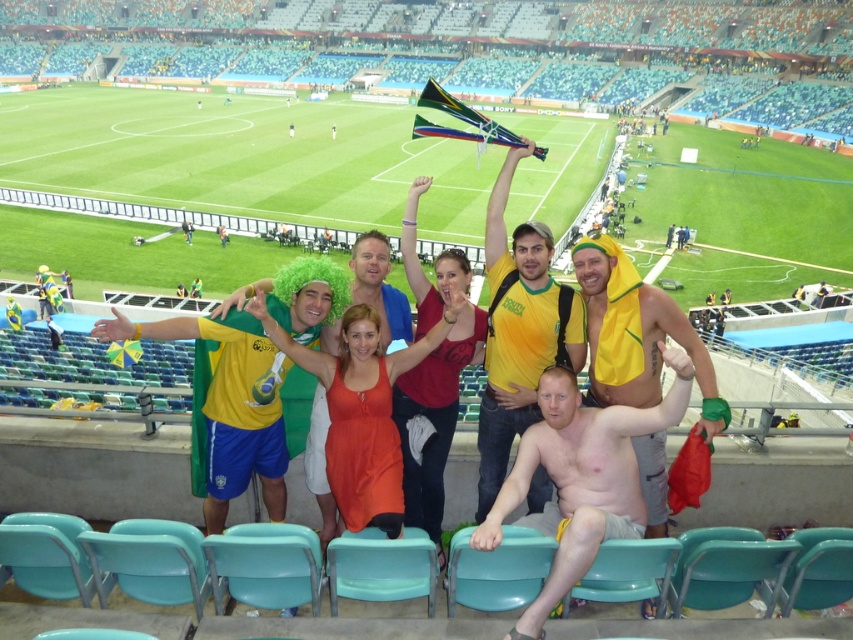
Does shiny metallic helmet at lower right appear under yellow fabric shirt at center?

Yes.

Is shiny metallic helmet at lower right wider than yellow fabric shirt at center?

Indeed, shiny metallic helmet at lower right has a greater width compared to yellow fabric shirt at center.

This screenshot has width=853, height=640. What are the coordinates of `shiny metallic helmet at lower right` in the screenshot? It's located at (581, 477).

Find the location of a particular element. Image resolution: width=853 pixels, height=640 pixels. shiny metallic helmet at lower right is located at coordinates (581, 477).

Is yellow fabric shirt at center to the left of yellow fabric towel at right from the viewer's perspective?

Correct, you'll find yellow fabric shirt at center to the left of yellow fabric towel at right.

Is yellow fabric shirt at center smaller than yellow fabric towel at right?

Incorrect, yellow fabric shirt at center is not smaller in size than yellow fabric towel at right.

The width and height of the screenshot is (853, 640). What do you see at coordinates (519, 330) in the screenshot?
I see `yellow fabric shirt at center` at bounding box center [519, 330].

Image resolution: width=853 pixels, height=640 pixels. What are the coordinates of `yellow fabric shirt at center` in the screenshot? It's located at tap(519, 330).

Is point (567, 403) farther from viewer compared to point (641, 301)?

No, it is not.

Between point (567, 509) and point (636, 397), which one is positioned behind?

The point (636, 397) is behind.

Is point (602, 502) positioned behind point (680, 346)?

No, (602, 502) is closer to viewer.

I want to click on shiny metallic helmet at lower right, so click(581, 477).